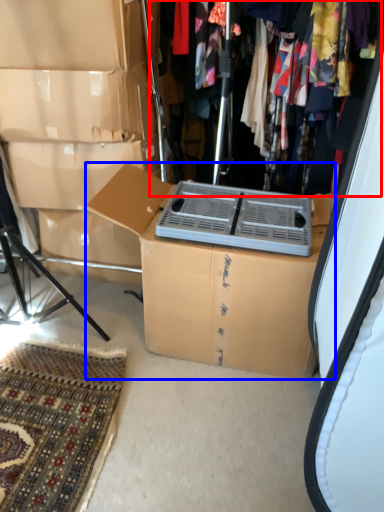
Question: Among these objects, which one is nearest to the camera, closet (highlighted by a red box) or box (highlighted by a blue box)?

Choices:
 (A) closet
 (B) box

Answer: (B)